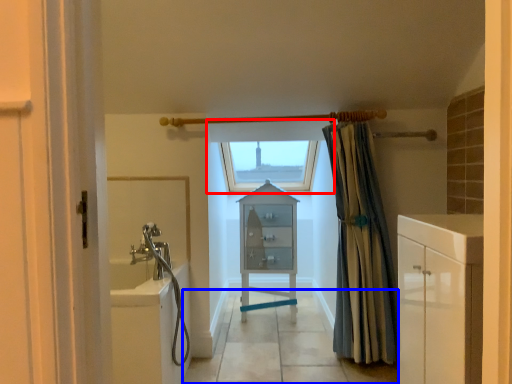
Question: Which object is closer to the camera taking this photo, window (highlighted by a red box) or path (highlighted by a blue box)?

Choices:
 (A) window
 (B) path

Answer: (B)